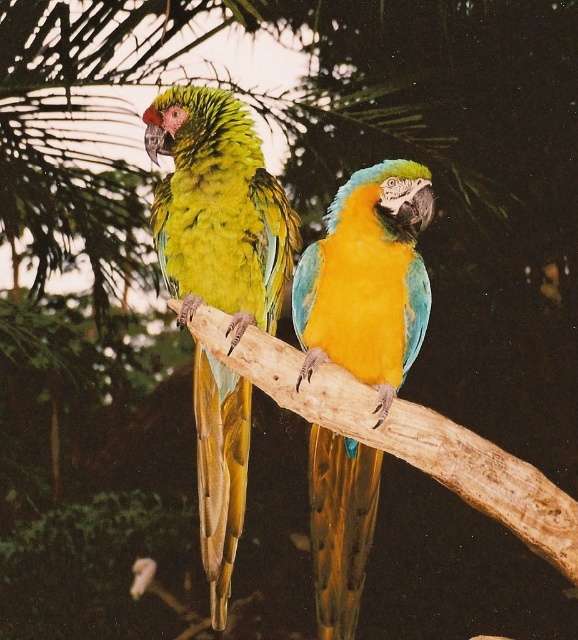
Which is above, green matte parrot at left or shiny blue-green parrot at center?

green matte parrot at left is above.

Between green matte parrot at left and shiny blue-green parrot at center, which one has more height?

green matte parrot at left

I want to click on green matte parrot at left, so 218,209.

Locate an element on the screen. The image size is (578, 640). green matte parrot at left is located at coordinates (218, 209).

Image resolution: width=578 pixels, height=640 pixels. What do you see at coordinates (218, 209) in the screenshot?
I see `green matte parrot at left` at bounding box center [218, 209].

Locate an element on the screen. This screenshot has height=640, width=578. green matte parrot at left is located at coordinates (218, 209).

Where is `green matte parrot at left`? The image size is (578, 640). green matte parrot at left is located at coordinates (218, 209).

Is point (346, 460) less distant than point (539, 524)?

No, it is not.

Does shiny blue-green parrot at center appear on the left side of brown rough tree branch at center?

Indeed, shiny blue-green parrot at center is positioned on the left side of brown rough tree branch at center.

You are a GUI agent. You are given a task and a screenshot of the screen. Output one action in this format:
    pyautogui.click(x=<x>, y=<y>)
    Task: Click on the shiny blue-green parrot at center
    Image resolution: width=578 pixels, height=640 pixels.
    Given the screenshot: What is the action you would take?
    [368, 280]